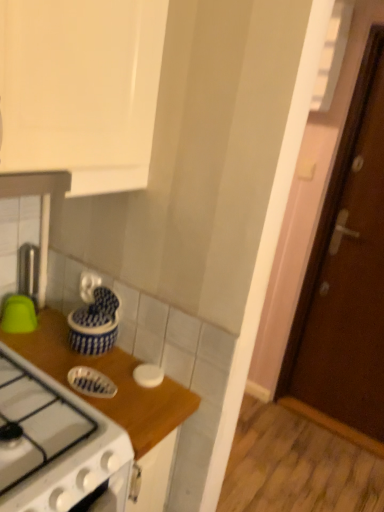
Locate an element on the screen. free point behind blue glossy dish at center, arranged as the 2th kitchen appliance when viewed from the right is located at coordinates click(x=103, y=359).